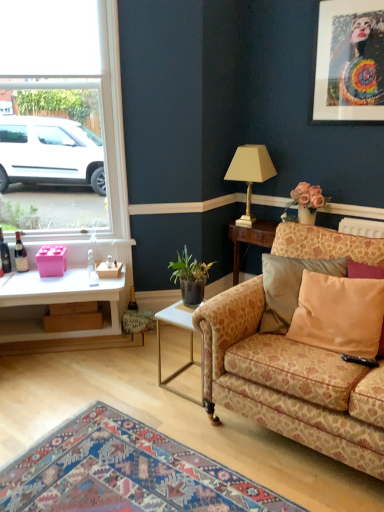
At what (x,y) coordinates should I click in order to perform the action: click on vacant area that lies to the right of matte glass bottle at left, the second bottle when ordered from right to left. Please return your answer as a coordinate pair (x, y). The image size is (384, 512). Looking at the image, I should click on (35, 275).